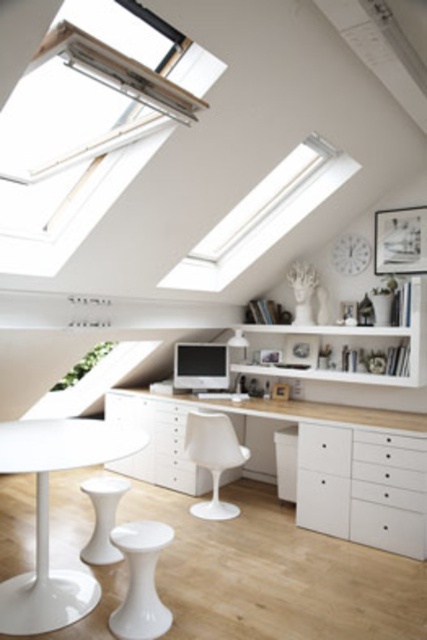
Measure the distance between transparent glass window at upper center and white plastic chair at center.

transparent glass window at upper center and white plastic chair at center are 1.26 meters apart.

In the scene shown: Can you confirm if transparent glass window at upper center is positioned above white plastic chair at center?

Yes, transparent glass window at upper center is above white plastic chair at center.

Does point (184, 272) come behind point (234, 506)?

No, (184, 272) is closer to viewer.

Locate an element on the screen. This screenshot has width=427, height=640. transparent glass window at upper center is located at coordinates (263, 216).

Is point (215, 445) positioned after point (207, 362)?

No, it is not.

Is white plastic chair at center shorter than satin silver monitor at center?

In fact, white plastic chair at center may be taller than satin silver monitor at center.

Is point (201, 449) positioned behind point (172, 369)?

No, it is not.

Locate an element on the screen. The height and width of the screenshot is (640, 427). white plastic chair at center is located at coordinates (213, 458).

Who is positioned more to the right, white matte/wooden computer desk at center or white matte drawer at center?

Positioned to the right is white matte drawer at center.

Is white matte/wooden computer desk at center bigger than white matte drawer at center?

Indeed, white matte/wooden computer desk at center has a larger size compared to white matte drawer at center.

Is point (345, 445) more distant than point (319, 444)?

No, (345, 445) is in front of (319, 444).

Find the location of a particular element. The image size is (427, 640). white matte/wooden computer desk at center is located at coordinates (298, 467).